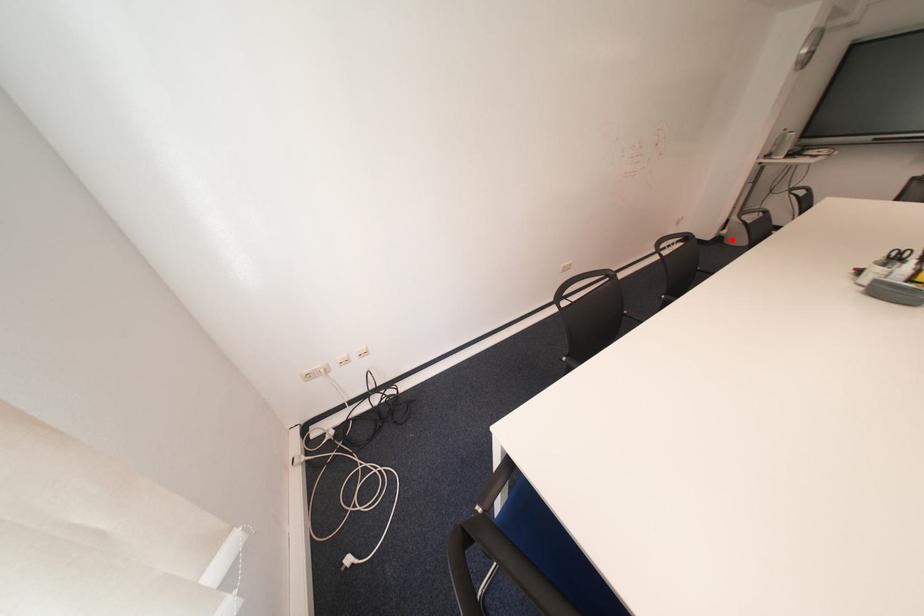
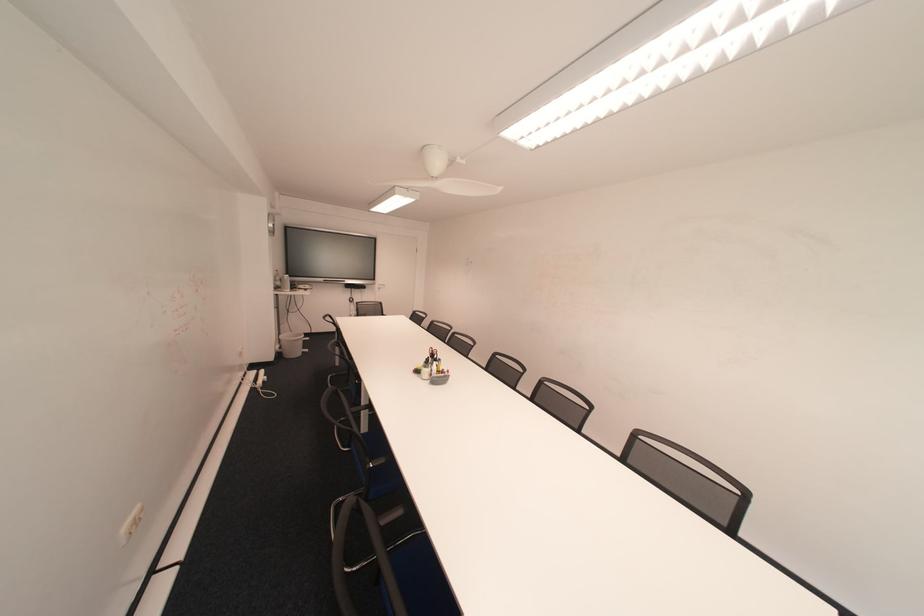
The point at the highlighted location is marked in the first image. Where is the corresponding point in the second image?

(290, 355)